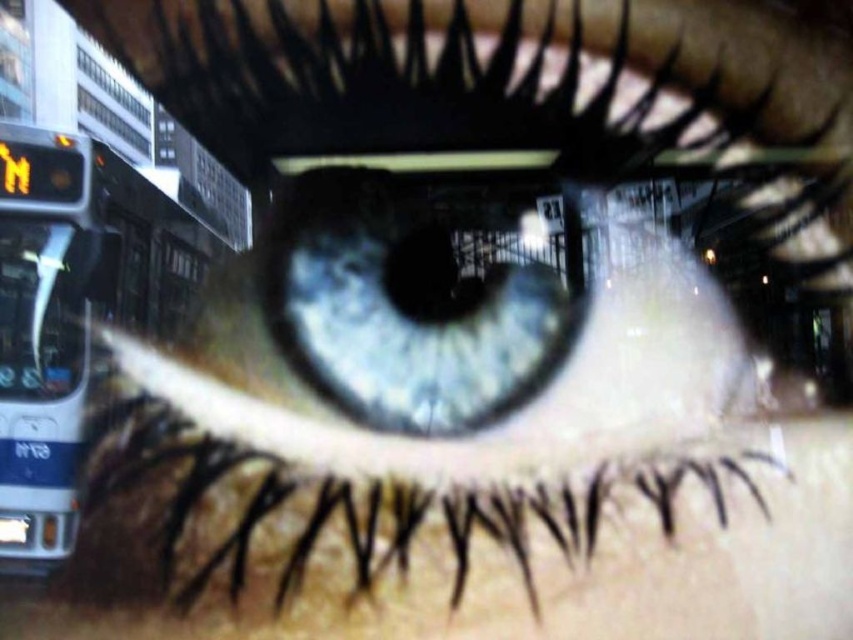
Based on the photo, does blue iridescent eye at center appear under white plastic bus at left?

No.

Who is more distant from viewer, (370, 292) or (19, 227)?

The point (370, 292) is behind.

This screenshot has height=640, width=853. What are the coordinates of `blue iridescent eye at center` in the screenshot? It's located at (415, 298).